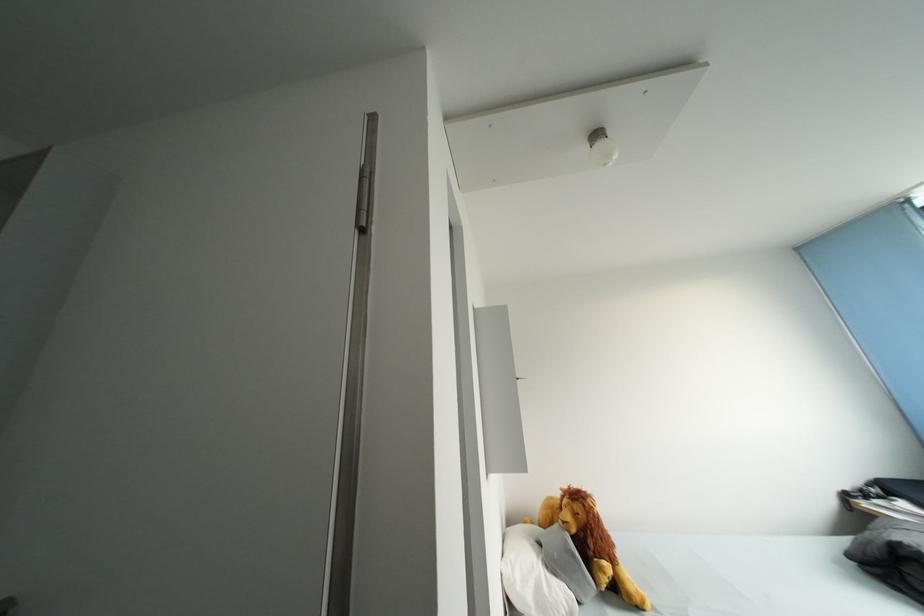
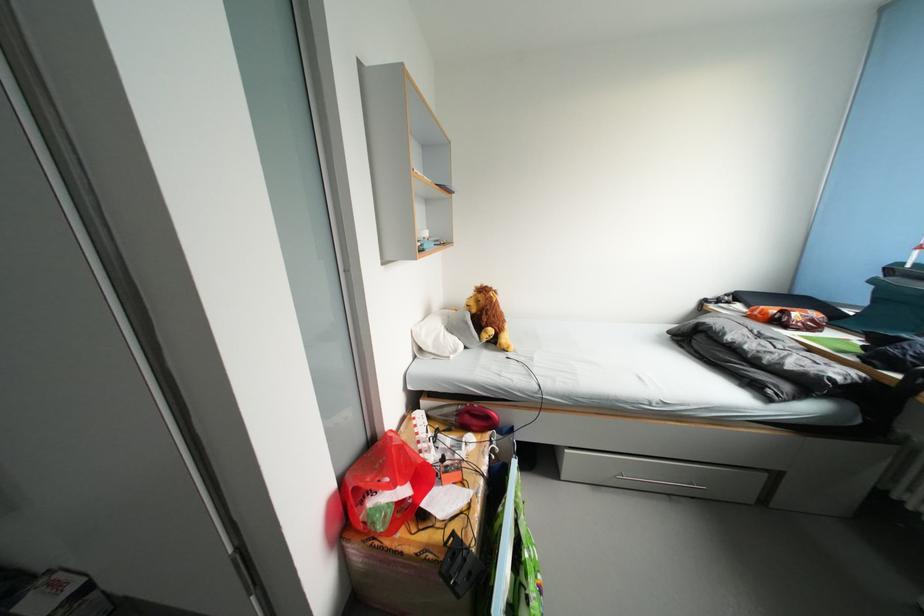
Question: The images are taken continuously from a first-person perspective. In which direction is your viewpoint rotating?

Choices:
 (A) Left
 (B) Right
 (C) Up
 (D) Down

Answer: (D)